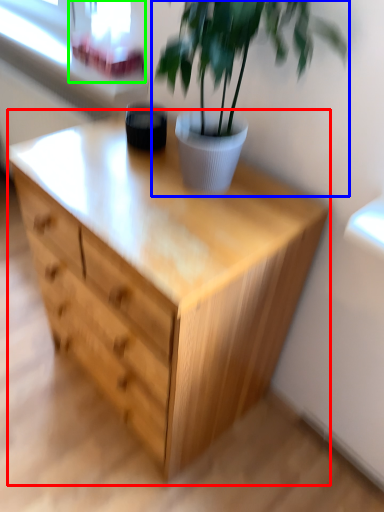
Question: Based on their relative distances, which object is farther from chest of drawers (highlighted by a red box)? Choose from houseplant (highlighted by a blue box) and window screen (highlighted by a green box).

Choices:
 (A) houseplant
 (B) window screen

Answer: (B)